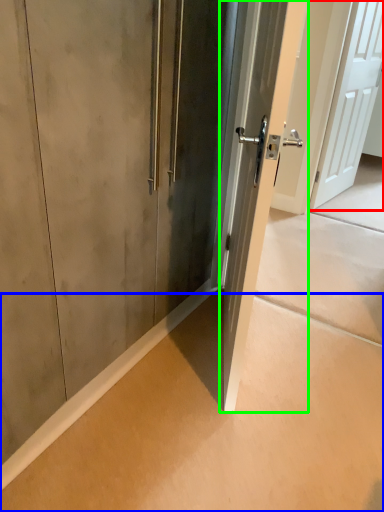
Question: Which object is the closest to the door (highlighted by a red box)? Choose among these: concrete (highlighted by a blue box) or door (highlighted by a green box).

Choices:
 (A) concrete
 (B) door

Answer: (B)